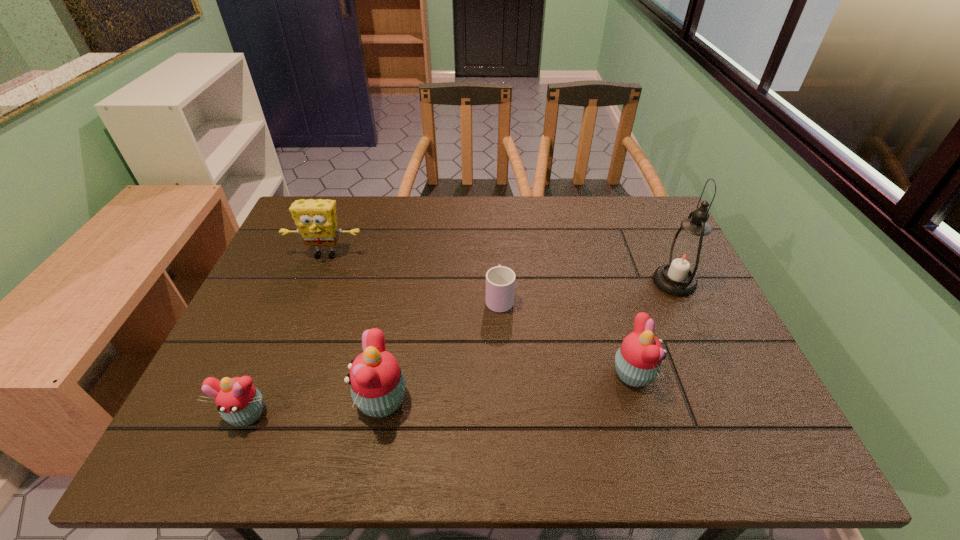
At what (x,y) coordinates should I click in order to perform the action: click on blank region between the second cupcake from left to right and the third object from right to left. Please return your answer as a coordinate pair (x, y). The image size is (960, 540). Looking at the image, I should click on (441, 349).

You are a GUI agent. You are given a task and a screenshot of the screen. Output one action in this format:
    pyautogui.click(x=<x>, y=<y>)
    Task: Click on the vacant space in between the sponge and the fourth tallest object
    
    Given the screenshot: What is the action you would take?
    pyautogui.click(x=479, y=315)

The height and width of the screenshot is (540, 960). What are the coordinates of `free point between the tallest object and the leftmost cupcake` in the screenshot? It's located at (461, 348).

This screenshot has height=540, width=960. I want to click on free space between the third object from left to right and the rightmost object, so click(528, 341).

You are a GUI agent. You are given a task and a screenshot of the screen. Output one action in this format:
    pyautogui.click(x=<x>, y=<y>)
    Task: Click on the free spot between the rightmost cupcake and the leftmost cupcake
    The image size is (960, 540).
    Given the screenshot: What is the action you would take?
    pyautogui.click(x=440, y=394)

At what (x,y) coordinates should I click in order to perform the action: click on free area in between the shortest cupcake and the sponge. Please return your answer as a coordinate pair (x, y). The width and height of the screenshot is (960, 540). Looking at the image, I should click on (286, 334).

Locate an element on the screen. free space that is in between the second cupcake from left to right and the leftmost cupcake is located at coordinates (315, 407).

Locate an element on the screen. object that is the third closest to the cup is located at coordinates [316, 221].

Where is `the second closest object relative to the sponge`? This screenshot has height=540, width=960. the second closest object relative to the sponge is located at coordinates (500, 281).

Identify the location of cupcake that is the third closest one to the tallest object. The width and height of the screenshot is (960, 540). (238, 401).